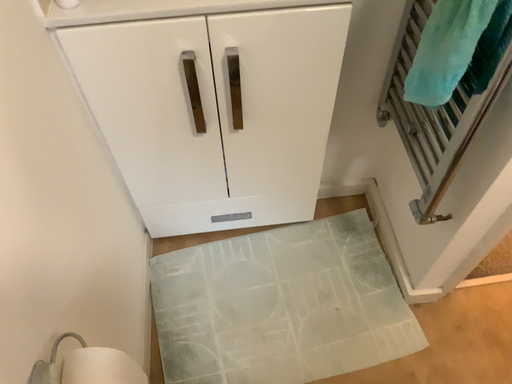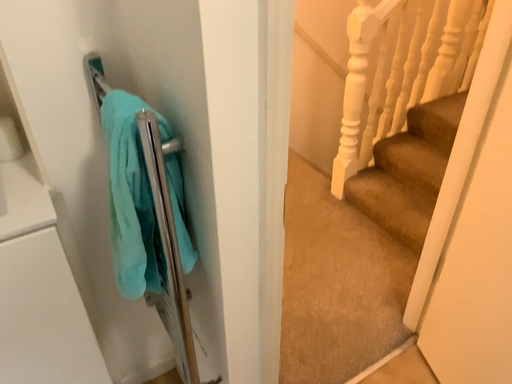
Question: How did the camera likely rotate when shooting the video?

Choices:
 (A) rotated right
 (B) rotated left

Answer: (A)